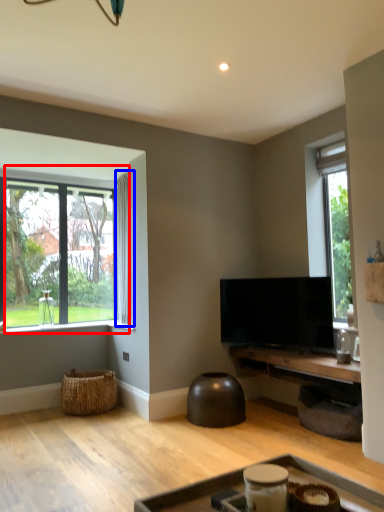
Question: Which object is closer to the camera taking this photo, window (highlighted by a red box) or curtain (highlighted by a blue box)?

Choices:
 (A) window
 (B) curtain

Answer: (A)